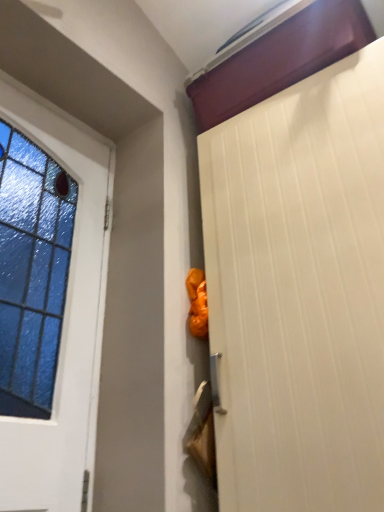
Question: In terms of size, does white textured door at upper right, the 1th door positioned from the right, appear bigger or smaller than white glass door at left, marked as the 2th door in a right-to-left arrangement?

Choices:
 (A) big
 (B) small

Answer: (A)

Question: From the image's perspective, is white textured door at upper right, the 1th door positioned from the right, above or below white glass door at left, marked as the 2th door in a right-to-left arrangement?

Choices:
 (A) above
 (B) below

Answer: (B)

Question: From a real-world perspective, is white textured door at upper right, the 2th door positioned from the left, positioned above or below white glass door at left, marked as the 2th door in a right-to-left arrangement?

Choices:
 (A) below
 (B) above

Answer: (A)

Question: Is white glass door at left, marked as the 2th door in a right-to-left arrangement, bigger or smaller than white textured door at upper right, the 1th door positioned from the right?

Choices:
 (A) big
 (B) small

Answer: (B)

Question: From their relative heights in the image, would you say white glass door at left, the first door in the left-to-right sequence, is taller or shorter than white textured door at upper right, the 1th door positioned from the right?

Choices:
 (A) tall
 (B) short

Answer: (B)

Question: From a real-world perspective, is white glass door at left, marked as the 2th door in a right-to-left arrangement, positioned above or below white textured door at upper right, the 1th door positioned from the right?

Choices:
 (A) above
 (B) below

Answer: (A)

Question: Relative to white textured door at upper right, the 2th door positioned from the left, is white glass door at left, the first door in the left-to-right sequence, in front or behind?

Choices:
 (A) behind
 (B) front

Answer: (A)